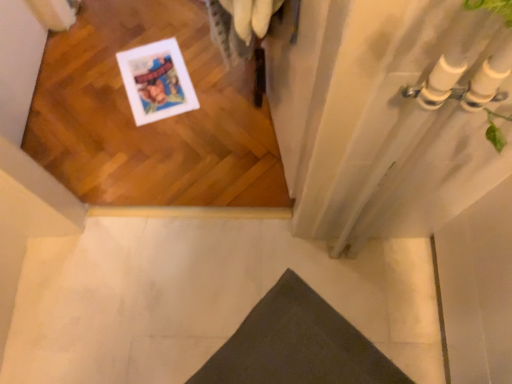
This screenshot has width=512, height=384. Describe the element at coordinates (200, 297) in the screenshot. I see `white tile floor at lower left` at that location.

Where is `white tile floor at lower left`? This screenshot has width=512, height=384. white tile floor at lower left is located at coordinates (200, 297).

The image size is (512, 384). What do you see at coordinates (297, 345) in the screenshot?
I see `dark gray fabric doormat at lower center` at bounding box center [297, 345].

Identify the location of dark gray fabric doormat at lower center. The width and height of the screenshot is (512, 384). (297, 345).

Locate an element on the screen. Image resolution: width=512 pixels, height=384 pixels. white tile floor at lower left is located at coordinates (200, 297).

Considering the relative positions of dark gray fabric doormat at lower center and white tile floor at lower left in the image provided, is dark gray fabric doormat at lower center to the right of white tile floor at lower left from the viewer's perspective?

Correct, you'll find dark gray fabric doormat at lower center to the right of white tile floor at lower left.

Based on the photo, between dark gray fabric doormat at lower center and white tile floor at lower left, which one is positioned in front?

dark gray fabric doormat at lower center is more forward.

Considering the points (294, 315) and (147, 250), which point is in front, point (294, 315) or point (147, 250)?

Point (294, 315)

From the image's perspective, does dark gray fabric doormat at lower center appear lower than white tile floor at lower left?

Yes.

From a real-world perspective, between dark gray fabric doormat at lower center and white tile floor at lower left, who is vertically lower?

white tile floor at lower left.

Between dark gray fabric doormat at lower center and white tile floor at lower left, which one has larger width?

With larger width is white tile floor at lower left.

Does dark gray fabric doormat at lower center have a greater height compared to white tile floor at lower left?

In fact, dark gray fabric doormat at lower center may be shorter than white tile floor at lower left.

Does dark gray fabric doormat at lower center have a larger size compared to white tile floor at lower left?

No.

Is dark gray fabric doormat at lower center positioned beyond the bounds of white tile floor at lower left?

Yes, dark gray fabric doormat at lower center is located beyond the bounds of white tile floor at lower left.

Are dark gray fabric doormat at lower center and white tile floor at lower left far apart?

Actually, dark gray fabric doormat at lower center and white tile floor at lower left are a little close together.

Is dark gray fabric doormat at lower center aimed at white tile floor at lower left?

Yes, dark gray fabric doormat at lower center is turned towards white tile floor at lower left.

Can you tell me how much dark gray fabric doormat at lower center and white tile floor at lower left differ in facing direction?

There is a 137-degree angle between the facing directions of dark gray fabric doormat at lower center and white tile floor at lower left.

The width and height of the screenshot is (512, 384). In order to click on doormat lying in front of the white tile floor at lower left in this screenshot , I will do `click(297, 345)`.

Can you confirm if white tile floor at lower left is positioned to the right of dark gray fabric doormat at lower center?

In fact, white tile floor at lower left is to the left of dark gray fabric doormat at lower center.

Is white tile floor at lower left positioned behind dark gray fabric doormat at lower center?

Yes, white tile floor at lower left is behind dark gray fabric doormat at lower center.

Which point is more distant from viewer, (297, 270) or (228, 362)?

The point (297, 270) is behind.

From the image's perspective, which one is positioned higher, white tile floor at lower left or dark gray fabric doormat at lower center?

white tile floor at lower left is shown above in the image.

From a real-world perspective, between white tile floor at lower left and dark gray fabric doormat at lower center, who is vertically lower?

From a 3D spatial view, white tile floor at lower left is below.

Does white tile floor at lower left have a greater width compared to dark gray fabric doormat at lower center?

Yes.

Is white tile floor at lower left taller than dark gray fabric doormat at lower center?

Yes.

Between white tile floor at lower left and dark gray fabric doormat at lower center, which one has smaller size?

Smaller between the two is dark gray fabric doormat at lower center.

Is white tile floor at lower left inside or outside of dark gray fabric doormat at lower center?

white tile floor at lower left is spatially situated outside dark gray fabric doormat at lower center.

Are white tile floor at lower left and dark gray fabric doormat at lower center located far from each other?

white tile floor at lower left is actually quite close to dark gray fabric doormat at lower center.

Is white tile floor at lower left looking in the opposite direction of dark gray fabric doormat at lower center?

No, dark gray fabric doormat at lower center is not at the back of white tile floor at lower left.

Where is `concrete that appears behind the dark gray fabric doormat at lower center`? The height and width of the screenshot is (384, 512). concrete that appears behind the dark gray fabric doormat at lower center is located at coordinates (200, 297).

Where is `concrete on the left of the dark gray fabric doormat at lower center`? concrete on the left of the dark gray fabric doormat at lower center is located at coordinates (200, 297).

The width and height of the screenshot is (512, 384). What are the coordinates of `concrete lying behind the dark gray fabric doormat at lower center` in the screenshot? It's located at (200, 297).